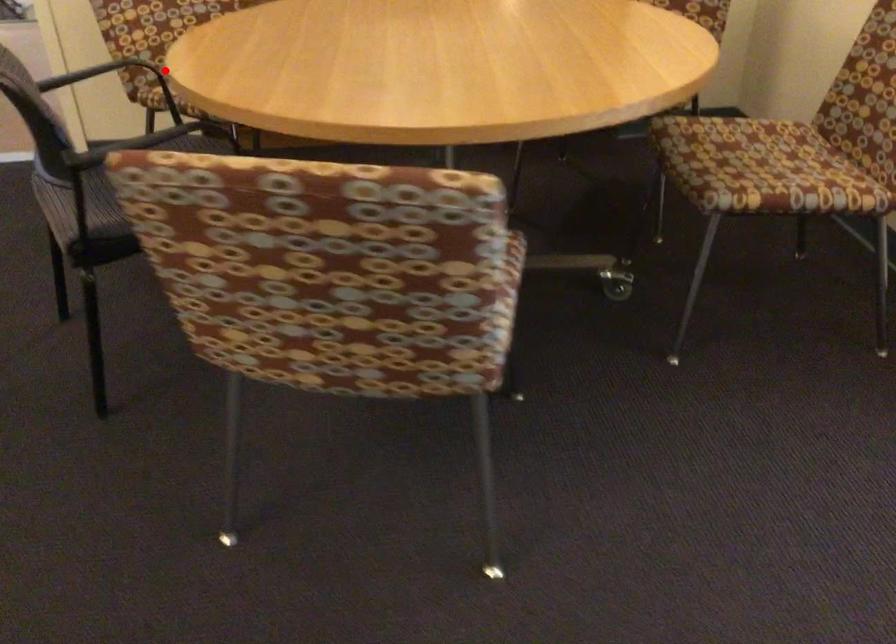
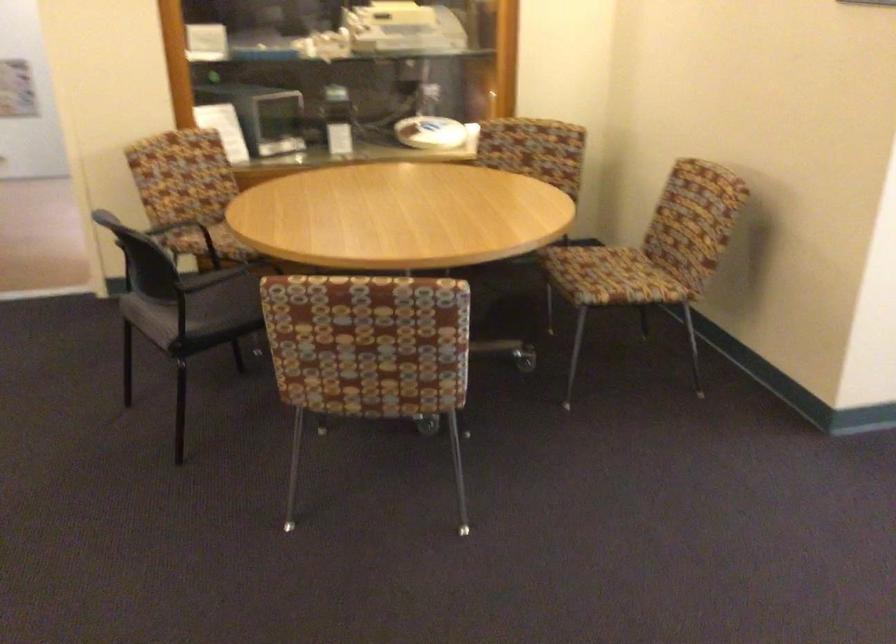
Question: A red point is marked in image1. In image2, is the corresponding 3D point closer to the camera or farther? Reply with the corresponding letter.

Choices:
 (A) The corresponding 3D point is closer.
 (B) The corresponding 3D point is farther.

Answer: (B)